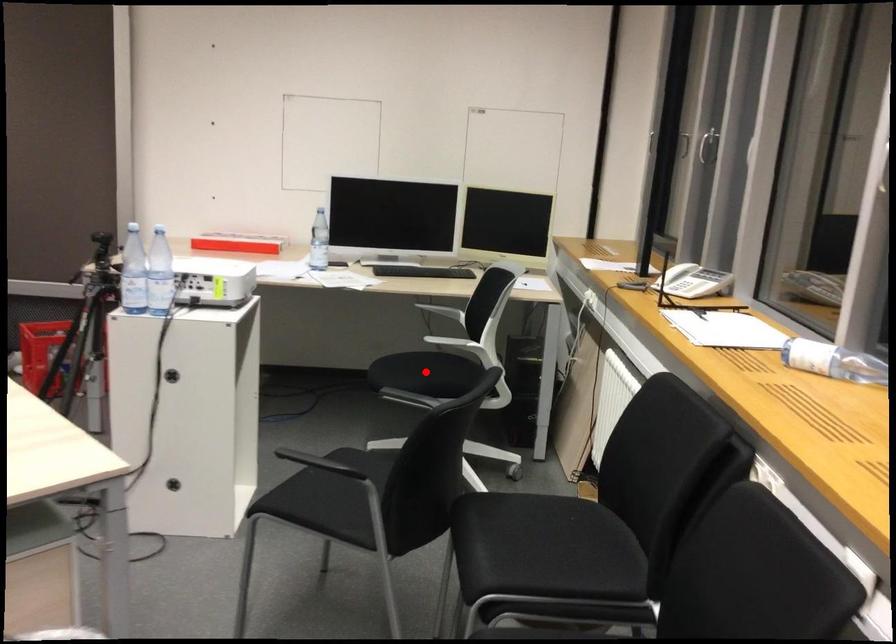
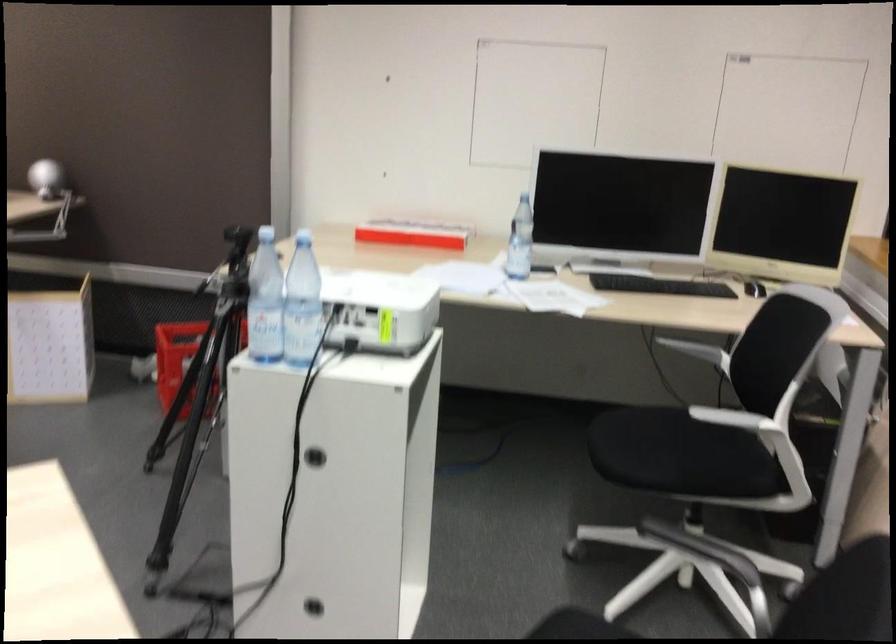
Find the pixel in the second image that matches the highlighted location in the first image.

(679, 455)